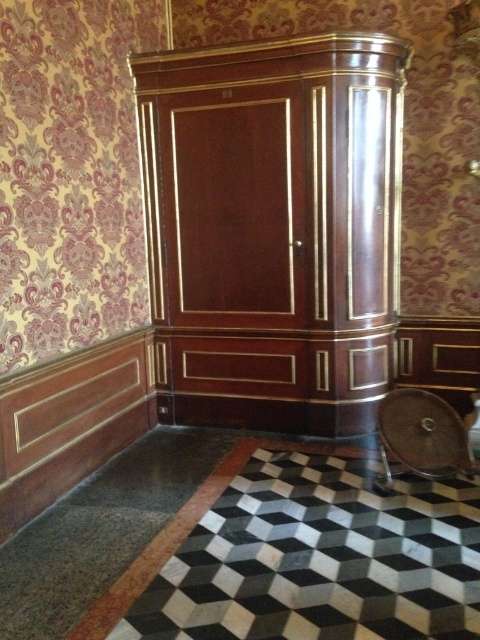
Question: Can you confirm if mahogany wood armoire at center is positioned below brown leather chair at lower right?

Choices:
 (A) no
 (B) yes

Answer: (A)

Question: Among these points, which one is nearest to the camera?

Choices:
 (A) (313, 326)
 (B) (432, 396)

Answer: (B)

Question: Which point is farther to the camera?

Choices:
 (A) pyautogui.click(x=240, y=253)
 (B) pyautogui.click(x=441, y=444)

Answer: (A)

Question: Is mahogany wood armoire at center further to the viewer compared to brown leather chair at lower right?

Choices:
 (A) yes
 (B) no

Answer: (A)

Question: Does mahogany wood armoire at center have a smaller size compared to brown leather chair at lower right?

Choices:
 (A) no
 (B) yes

Answer: (A)